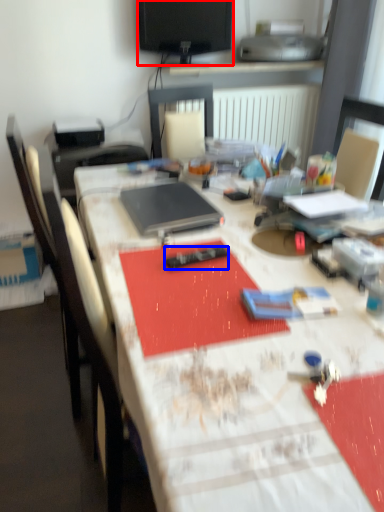
Question: Among these objects, which one is nearest to the camera, television (highlighted by a red box) or remote control (highlighted by a blue box)?

Choices:
 (A) television
 (B) remote control

Answer: (B)